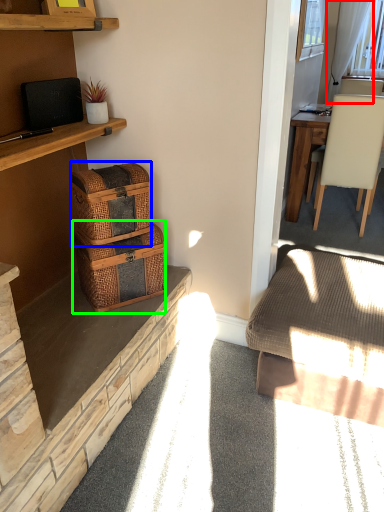
Question: Considering the real-world distances, which object is closest to curtain (highlighted by a red box)? picnic basket (highlighted by a blue box) or picnic basket (highlighted by a green box).

Choices:
 (A) picnic basket
 (B) picnic basket

Answer: (A)